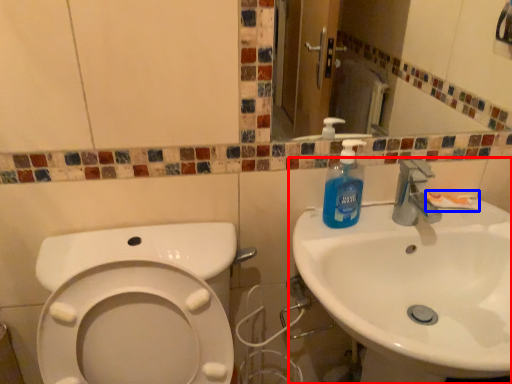
Question: Which object appears farthest to the camera in this image, sink (highlighted by a red box) or toothpaste (highlighted by a blue box)?

Choices:
 (A) sink
 (B) toothpaste

Answer: (B)